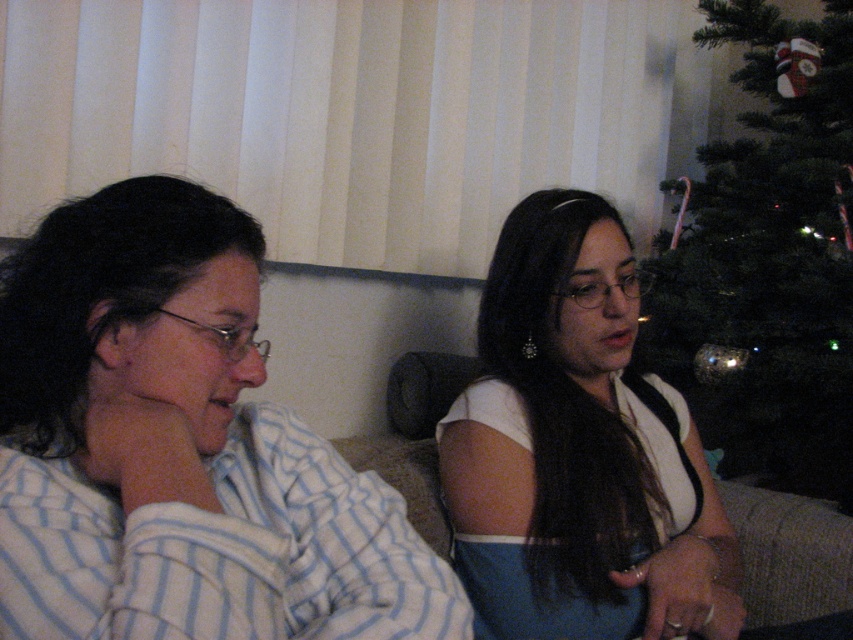
Does white striped pajamas at left have a lesser width compared to white fabric dress at center?

Yes, white striped pajamas at left is thinner than white fabric dress at center.

Is point (416, 595) behind point (527, 566)?

No, (416, 595) is in front of (527, 566).

Where is `white striped pajamas at left`? white striped pajamas at left is located at coordinates (173, 445).

You are a GUI agent. You are given a task and a screenshot of the screen. Output one action in this format:
    pyautogui.click(x=<x>, y=<y>)
    Task: Click on the white striped pajamas at left
    This screenshot has width=853, height=640.
    Given the screenshot: What is the action you would take?
    pyautogui.click(x=173, y=445)

Where is `white striped pajamas at left`? This screenshot has width=853, height=640. white striped pajamas at left is located at coordinates (173, 445).

Image resolution: width=853 pixels, height=640 pixels. What are the coordinates of `white striped pajamas at left` in the screenshot? It's located at (173, 445).

Locate an element on the screen. white striped pajamas at left is located at coordinates (173, 445).

Between white fabric dress at center and green matte christmas tree at right, which one is positioned higher?

Positioned higher is green matte christmas tree at right.

Is white fabric dress at center positioned in front of green matte christmas tree at right?

Yes, it is.

The width and height of the screenshot is (853, 640). I want to click on white fabric dress at center, so click(577, 451).